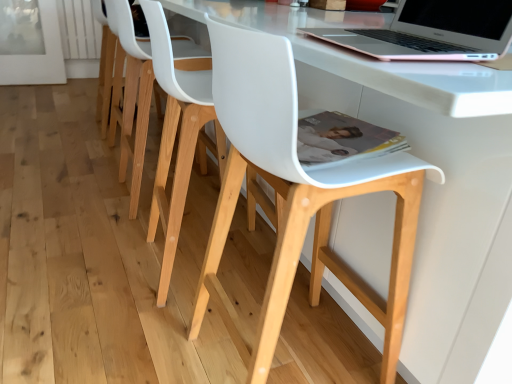
In order to face white matte chair at center, which is counted as the first chair, starting from the front, should I rotate leftwards or rightwards?

→ Turn right approximately 6.186 degrees to face it.

What do you see at coordinates (173, 140) in the screenshot? This screenshot has width=512, height=384. I see `white matte plastic chair at center, positioned as the second chair in back-to-front order` at bounding box center [173, 140].

The image size is (512, 384). Find the location of `white matte chair at center, the first chair from the back`. white matte chair at center, the first chair from the back is located at coordinates (131, 96).

Is white matte plastic chair at center, which appears as the second chair when viewed from the front, located outside rose gold aluminum laptop at upper right?

Yes.

Is white matte plastic chair at center, which appears as the second chair when viewed from the front, in front of or behind rose gold aluminum laptop at upper right in the image?

Clearly, white matte plastic chair at center, which appears as the second chair when viewed from the front, is behind rose gold aluminum laptop at upper right.

From the image's perspective, is white matte plastic chair at center, positioned as the second chair in back-to-front order, located above or below rose gold aluminum laptop at upper right?

Based on their image positions, white matte plastic chair at center, positioned as the second chair in back-to-front order, is located beneath rose gold aluminum laptop at upper right.

Which is in front, point (172, 243) or point (442, 51)?

The point (442, 51) is in front.

Considering the sizes of objects white matte chair at center, acting as the third chair starting from the back, and white matte chair at center, the first chair from the back, in the image provided, who is shorter, white matte chair at center, acting as the third chair starting from the back, or white matte chair at center, the first chair from the back,?

white matte chair at center, the first chair from the back.

Considering the sizes of objects white matte chair at center, which is counted as the first chair, starting from the front, and white matte chair at center, which ranks as the third chair in front-to-back order, in the image provided, who is bigger, white matte chair at center, which is counted as the first chair, starting from the front, or white matte chair at center, which ranks as the third chair in front-to-back order,?

white matte chair at center, which is counted as the first chair, starting from the front, is bigger.

Between white matte chair at center, acting as the third chair starting from the back, and white matte chair at center, the first chair from the back, which one appears on the right side from the viewer's perspective?

white matte chair at center, acting as the third chair starting from the back, is more to the right.

Measure the distance from white matte chair at center, acting as the third chair starting from the back, to white matte chair at center, the first chair from the back.

A distance of 37.83 inches exists between white matte chair at center, acting as the third chair starting from the back, and white matte chair at center, the first chair from the back.

Considering the relative sizes of rose gold aluminum laptop at upper right and white matte chair at center, which is counted as the first chair, starting from the front, in the image provided, is rose gold aluminum laptop at upper right taller than white matte chair at center, which is counted as the first chair, starting from the front,?

Incorrect, the height of rose gold aluminum laptop at upper right is not larger of that of white matte chair at center, which is counted as the first chair, starting from the front.

Is point (453, 14) farther from viewer compared to point (229, 329)?

No, it is not.

Considering the sizes of objects white matte plastic chair at center, which appears as the second chair when viewed from the front, and white matte chair at center, the first chair from the back, in the image provided, who is wider, white matte plastic chair at center, which appears as the second chair when viewed from the front, or white matte chair at center, the first chair from the back,?

Wider between the two is white matte plastic chair at center, which appears as the second chair when viewed from the front.

Is white matte plastic chair at center, positioned as the second chair in back-to-front order, completely or partially outside of white matte chair at center, the first chair from the back?

Yes, white matte plastic chair at center, positioned as the second chair in back-to-front order, is not within white matte chair at center, the first chair from the back.

Between point (155, 21) and point (121, 140), which one is positioned in front?

The point (155, 21) is closer to the camera.

From the image's perspective, is white matte plastic chair at center, which appears as the second chair when viewed from the front, below white matte chair at center, acting as the third chair starting from the back?

Actually, white matte plastic chair at center, which appears as the second chair when viewed from the front, appears above white matte chair at center, acting as the third chair starting from the back, in the image.

Is white matte plastic chair at center, positioned as the second chair in back-to-front order, next to white matte chair at center, which is counted as the first chair, starting from the front?

No, white matte plastic chair at center, positioned as the second chair in back-to-front order, is not in contact with white matte chair at center, which is counted as the first chair, starting from the front.

Based on the photo, in the image, is white matte plastic chair at center, which appears as the second chair when viewed from the front, positioned in front of or behind white matte chair at center, acting as the third chair starting from the back?

Visually, white matte plastic chair at center, which appears as the second chair when viewed from the front, is located behind white matte chair at center, acting as the third chair starting from the back.

Considering the positions of objects white matte plastic chair at center, positioned as the second chair in back-to-front order, and white matte chair at center, which is counted as the first chair, starting from the front, in the image provided, who is more to the right, white matte plastic chair at center, positioned as the second chair in back-to-front order, or white matte chair at center, which is counted as the first chair, starting from the front,?

white matte chair at center, which is counted as the first chair, starting from the front.

From a real-world perspective, which is physically below, white matte chair at center, which ranks as the third chair in front-to-back order, or white matte plastic chair at center, which appears as the second chair when viewed from the front?

white matte chair at center, which ranks as the third chair in front-to-back order.

Is white matte chair at center, which ranks as the third chair in front-to-back order, positioned far away from white matte plastic chair at center, which appears as the second chair when viewed from the front?

No, white matte chair at center, which ranks as the third chair in front-to-back order, is in close proximity to white matte plastic chair at center, which appears as the second chair when viewed from the front.

Relative to white matte plastic chair at center, positioned as the second chair in back-to-front order, is white matte chair at center, which ranks as the third chair in front-to-back order, in front or behind?

white matte chair at center, which ranks as the third chair in front-to-back order, is behind white matte plastic chair at center, positioned as the second chair in back-to-front order.

Can we say white matte chair at center, which ranks as the third chair in front-to-back order, lies outside white matte plastic chair at center, positioned as the second chair in back-to-front order?

Indeed, white matte chair at center, which ranks as the third chair in front-to-back order, is completely outside white matte plastic chair at center, positioned as the second chair in back-to-front order.

Is white matte chair at center, which is counted as the first chair, starting from the front, to the right of rose gold aluminum laptop at upper right from the viewer's perspective?

No, white matte chair at center, which is counted as the first chair, starting from the front, is not to the right of rose gold aluminum laptop at upper right.

From a real-world perspective, is white matte chair at center, acting as the third chair starting from the back, located higher than rose gold aluminum laptop at upper right?

No, from a real-world perspective, white matte chair at center, acting as the third chair starting from the back, is not above rose gold aluminum laptop at upper right.

Is white matte chair at center, acting as the third chair starting from the back, touching rose gold aluminum laptop at upper right?

white matte chair at center, acting as the third chair starting from the back, and rose gold aluminum laptop at upper right are not in contact.

From a real-world perspective, starting from the rose gold aluminum laptop at upper right, which chair is the 1st one below it? Please provide its 2D coordinates.

[(173, 140)]

The height and width of the screenshot is (384, 512). What are the coordinates of `chair that is the 2nd object located in front of the white matte chair at center, which ranks as the third chair in front-to-back order` in the screenshot? It's located at (296, 197).

Looking at the image, which one is located further to white matte chair at center, acting as the third chair starting from the back, white matte chair at center, which ranks as the third chair in front-to-back order, or white matte plastic chair at center, positioned as the second chair in back-to-front order?

The object further to white matte chair at center, acting as the third chair starting from the back, is white matte chair at center, which ranks as the third chair in front-to-back order.

Which object lies nearer to the anchor point rose gold aluminum laptop at upper right, white matte chair at center, which is counted as the first chair, starting from the front, or white matte plastic chair at center, positioned as the second chair in back-to-front order?

Based on the image, white matte chair at center, which is counted as the first chair, starting from the front, appears to be nearer to rose gold aluminum laptop at upper right.

Based on their spatial positions, is white matte chair at center, which is counted as the first chair, starting from the front, or white matte chair at center, the first chair from the back, further from rose gold aluminum laptop at upper right?

white matte chair at center, the first chair from the back.

Estimate the real-world distances between objects in this image. Which object is closer to rose gold aluminum laptop at upper right, white matte plastic chair at center, which appears as the second chair when viewed from the front, or white matte chair at center, which is counted as the first chair, starting from the front?

white matte chair at center, which is counted as the first chair, starting from the front, is positioned closer to the anchor rose gold aluminum laptop at upper right.

Based on their spatial positions, is rose gold aluminum laptop at upper right or white matte chair at center, the first chair from the back, further from white matte plastic chair at center, positioned as the second chair in back-to-front order?

Among the two, rose gold aluminum laptop at upper right is located further to white matte plastic chair at center, positioned as the second chair in back-to-front order.

Which object lies further to the anchor point rose gold aluminum laptop at upper right, white matte chair at center, the first chair from the back, or white matte plastic chair at center, positioned as the second chair in back-to-front order?

white matte chair at center, the first chair from the back, is positioned further to the anchor rose gold aluminum laptop at upper right.

Estimate the real-world distances between objects in this image. Which object is further from white matte chair at center, which is counted as the first chair, starting from the front, rose gold aluminum laptop at upper right or white matte plastic chair at center, positioned as the second chair in back-to-front order?

white matte plastic chair at center, positioned as the second chair in back-to-front order, is positioned further to the anchor white matte chair at center, which is counted as the first chair, starting from the front.

Based on their spatial positions, is rose gold aluminum laptop at upper right or white matte plastic chair at center, positioned as the second chair in back-to-front order, closer to white matte chair at center, the first chair from the back?

Among the two, white matte plastic chair at center, positioned as the second chair in back-to-front order, is located nearer to white matte chair at center, the first chair from the back.

Where is `chair between white matte chair at center, which is counted as the first chair, starting from the front, and white matte chair at center, which ranks as the third chair in front-to-back order, in the front-back direction`? Image resolution: width=512 pixels, height=384 pixels. chair between white matte chair at center, which is counted as the first chair, starting from the front, and white matte chair at center, which ranks as the third chair in front-to-back order, in the front-back direction is located at coordinates (173, 140).

This screenshot has height=384, width=512. Find the location of `laptop located between white matte chair at center, which is counted as the first chair, starting from the front, and white matte plastic chair at center, which appears as the second chair when viewed from the front, in the depth direction`. laptop located between white matte chair at center, which is counted as the first chair, starting from the front, and white matte plastic chair at center, which appears as the second chair when viewed from the front, in the depth direction is located at coordinates (432, 32).

Where is `laptop located between white matte chair at center, acting as the third chair starting from the back, and white matte chair at center, which ranks as the third chair in front-to-back order, in the depth direction`? laptop located between white matte chair at center, acting as the third chair starting from the back, and white matte chair at center, which ranks as the third chair in front-to-back order, in the depth direction is located at coordinates (432, 32).

Locate an element on the screen. chair located between rose gold aluminum laptop at upper right and white matte chair at center, which ranks as the third chair in front-to-back order, in the depth direction is located at coordinates (173, 140).